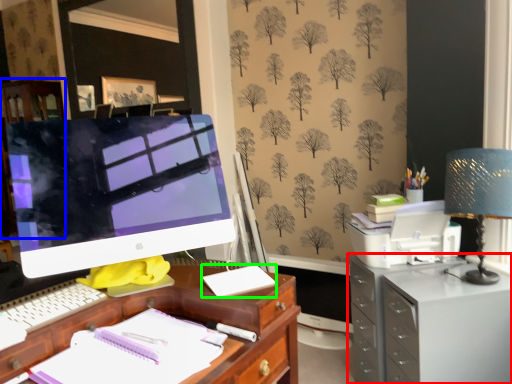
Question: Which object is the closest to the filing cabinet (highlighted by a red box)? Choose among these: dresser (highlighted by a blue box) or office supplies (highlighted by a green box).

Choices:
 (A) dresser
 (B) office supplies

Answer: (B)